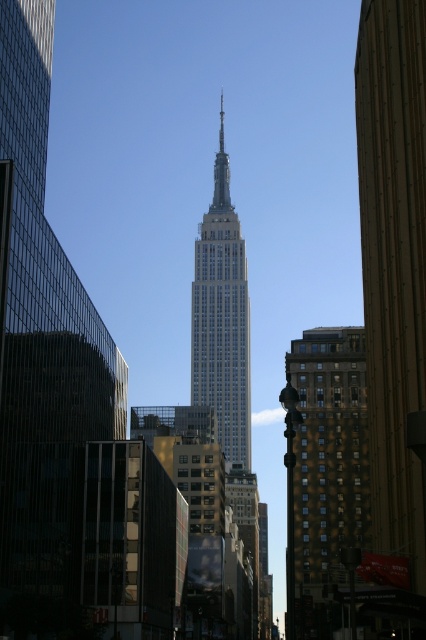
Does point (336, 476) lie behind point (236, 426)?

No, it is not.

Between point (348, 536) and point (196, 324), which one is positioned behind?

The point (196, 324) is behind.

The width and height of the screenshot is (426, 640). In order to click on brown brick building at right in this screenshot , I will do `click(328, 467)`.

Can you confirm if brown brick building at right is shorter than polished steel spire at center?

Yes.

You are a GUI agent. You are given a task and a screenshot of the screen. Output one action in this format:
    pyautogui.click(x=<x>, y=<y>)
    Task: Click on the brown brick building at right
    The width and height of the screenshot is (426, 640).
    Given the screenshot: What is the action you would take?
    pyautogui.click(x=328, y=467)

What do you see at coordinates (328, 467) in the screenshot? I see `brown brick building at right` at bounding box center [328, 467].

The height and width of the screenshot is (640, 426). I want to click on brown brick building at right, so click(x=328, y=467).

Does white glass building at center have a larger size compared to polished steel spire at center?

Indeed, white glass building at center has a larger size compared to polished steel spire at center.

What are the coordinates of `white glass building at center` in the screenshot? It's located at (221, 317).

Does point (224, 419) come closer to viewer compared to point (219, 208)?

Yes, point (224, 419) is in front of point (219, 208).

Image resolution: width=426 pixels, height=640 pixels. In order to click on white glass building at center in this screenshot , I will do `click(221, 317)`.